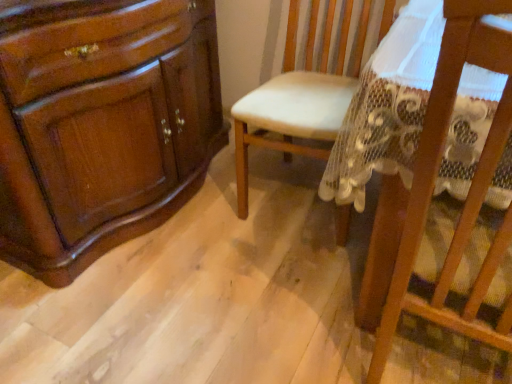
Question: Considering the positions of wooden chair at center, the 2th chair from the back, and white leather chair at center, the 1th chair positioned from the back, in the image, is wooden chair at center, the 2th chair from the back, taller or shorter than white leather chair at center, the 1th chair positioned from the back,?

Choices:
 (A) short
 (B) tall

Answer: (B)

Question: Is wooden chair at center, acting as the first chair starting from the front, wider or thinner than white leather chair at center, which is counted as the second chair, starting from the front?

Choices:
 (A) thin
 (B) wide

Answer: (A)

Question: From a real-world perspective, is wooden chair at center, the 2th chair from the back, physically located above or below white leather chair at center, the 1th chair positioned from the back?

Choices:
 (A) above
 (B) below

Answer: (A)

Question: Is white leather chair at center, which is counted as the second chair, starting from the front, wider or thinner than wooden chair at center, the 2th chair from the back?

Choices:
 (A) wide
 (B) thin

Answer: (A)

Question: From a real-world perspective, is white leather chair at center, the 1th chair positioned from the back, above or below wooden chair at center, the 2th chair from the back?

Choices:
 (A) below
 (B) above

Answer: (A)

Question: From the image's perspective, is white leather chair at center, the 1th chair positioned from the back, located above or below wooden chair at center, the 2th chair from the back?

Choices:
 (A) below
 (B) above

Answer: (B)

Question: Which is correct: white leather chair at center, which is counted as the second chair, starting from the front, is inside wooden chair at center, the 2th chair from the back, or outside of it?

Choices:
 (A) outside
 (B) inside

Answer: (A)